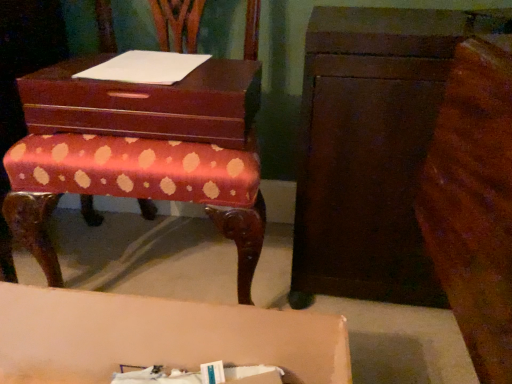
Question: From a real-world perspective, does dark brown wood chest of drawers at right stand above white paper at upper center?

Choices:
 (A) no
 (B) yes

Answer: (A)

Question: From the image's perspective, is dark brown wood chest of drawers at right beneath white paper at upper center?

Choices:
 (A) no
 (B) yes

Answer: (B)

Question: Is dark brown wood chest of drawers at right smaller than white paper at upper center?

Choices:
 (A) yes
 (B) no

Answer: (B)

Question: Is dark brown wood chest of drawers at right positioned far away from white paper at upper center?

Choices:
 (A) no
 (B) yes

Answer: (A)

Question: Is dark brown wood chest of drawers at right outside of white paper at upper center?

Choices:
 (A) no
 (B) yes

Answer: (B)

Question: From the image's perspective, would you say dark brown wood chest of drawers at right is positioned over white paper at upper center?

Choices:
 (A) no
 (B) yes

Answer: (A)

Question: Is mahogany wood storage box at center a part of dark brown wood chest of drawers at right?

Choices:
 (A) yes
 (B) no

Answer: (B)

Question: Considering the relative positions of dark brown wood chest of drawers at right and mahogany wood storage box at center in the image provided, is dark brown wood chest of drawers at right in front of mahogany wood storage box at center?

Choices:
 (A) no
 (B) yes

Answer: (B)

Question: Considering the relative sizes of dark brown wood chest of drawers at right and mahogany wood storage box at center in the image provided, is dark brown wood chest of drawers at right shorter than mahogany wood storage box at center?

Choices:
 (A) no
 (B) yes

Answer: (A)

Question: Is dark brown wood chest of drawers at right positioned far away from mahogany wood storage box at center?

Choices:
 (A) no
 (B) yes

Answer: (A)

Question: Is dark brown wood chest of drawers at right placed right next to mahogany wood storage box at center?

Choices:
 (A) yes
 (B) no

Answer: (B)

Question: Considering the relative sizes of dark brown wood chest of drawers at right and mahogany wood storage box at center in the image provided, is dark brown wood chest of drawers at right smaller than mahogany wood storage box at center?

Choices:
 (A) no
 (B) yes

Answer: (A)

Question: From the image's perspective, is matte pink table at lower center below mahogany wood storage box at center?

Choices:
 (A) no
 (B) yes

Answer: (B)